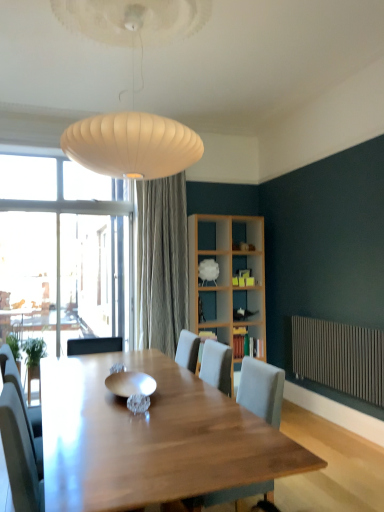
What do you see at coordinates (213, 335) in the screenshot?
I see `wooden bookshelf at center, the second shelf ordered from the bottom` at bounding box center [213, 335].

Where is `wooden bookshelf at center, positioned as the 1th shelf in bottom-to-top order`? Image resolution: width=384 pixels, height=512 pixels. wooden bookshelf at center, positioned as the 1th shelf in bottom-to-top order is located at coordinates 247,344.

Based on the photo, measure the distance between metallic radiator at lower right and camera.

The distance of metallic radiator at lower right from camera is 3.45 meters.

Locate an element on the screen. The width and height of the screenshot is (384, 512). wooden bookshelf at center, the second shelf ordered from the bottom is located at coordinates (213, 335).

Between white fabric at upper center, marked as the 1th shelf in a top-to-bottom arrangement, and wooden bookshelf at center, placed as the 2th shelf when sorted from top to bottom, which one has more height?

Standing taller between the two is white fabric at upper center, marked as the 1th shelf in a top-to-bottom arrangement.

Does white fabric at upper center, marked as the 1th shelf in a top-to-bottom arrangement, have a smaller size compared to wooden bookshelf at center, the second shelf ordered from the bottom?

Incorrect, white fabric at upper center, marked as the 1th shelf in a top-to-bottom arrangement, is not smaller in size than wooden bookshelf at center, the second shelf ordered from the bottom.

Is point (198, 271) closer or farther from the camera than point (222, 330)?

Point (198, 271).

From a real-world perspective, is white fabric at upper center, the third shelf in the bottom-to-top sequence, physically located above or below wooden bookshelf at center, the second shelf ordered from the bottom?

In terms of real-world spatial position, white fabric at upper center, the third shelf in the bottom-to-top sequence, is above wooden bookshelf at center, the second shelf ordered from the bottom.

Considering the positions of objects wooden bookshelf at center, positioned as the 1th shelf in bottom-to-top order, and shiny metallic bowl at center in the image provided, who is in front, wooden bookshelf at center, positioned as the 1th shelf in bottom-to-top order, or shiny metallic bowl at center?

shiny metallic bowl at center is closer to the camera.

Can you confirm if wooden bookshelf at center, positioned as the 1th shelf in bottom-to-top order, is wider than shiny metallic bowl at center?

Yes, wooden bookshelf at center, positioned as the 1th shelf in bottom-to-top order, is wider than shiny metallic bowl at center.

Considering the sizes of wooden bookshelf at center, marked as the 3th shelf in a top-to-bottom arrangement, and shiny metallic bowl at center in the image, is wooden bookshelf at center, marked as the 3th shelf in a top-to-bottom arrangement, taller or shorter than shiny metallic bowl at center?

wooden bookshelf at center, marked as the 3th shelf in a top-to-bottom arrangement, is taller than shiny metallic bowl at center.

Consider the image. Could you tell me if metallic radiator at lower right is facing wooden bookshelf at center, positioned as the 1th shelf in bottom-to-top order?

No, metallic radiator at lower right is not turned towards wooden bookshelf at center, positioned as the 1th shelf in bottom-to-top order.

Consider the image. From the image's perspective, is metallic radiator at lower right located above wooden bookshelf at center, positioned as the 1th shelf in bottom-to-top order?

Yes, from the image's perspective, metallic radiator at lower right is over wooden bookshelf at center, positioned as the 1th shelf in bottom-to-top order.

From the picture: Which object is further away from the camera, metallic radiator at lower right or wooden bookshelf at center, marked as the 3th shelf in a top-to-bottom arrangement?

wooden bookshelf at center, marked as the 3th shelf in a top-to-bottom arrangement.

From a real-world perspective, is wooden bookshelf at center, placed as the 2th shelf when sorted from top to bottom, beneath wooden bookshelf at center, positioned as the 1th shelf in bottom-to-top order?

Actually, wooden bookshelf at center, placed as the 2th shelf when sorted from top to bottom, is physically above wooden bookshelf at center, positioned as the 1th shelf in bottom-to-top order, in the real world.

Is wooden bookshelf at center, the second shelf ordered from the bottom, facing away from wooden bookshelf at center, marked as the 3th shelf in a top-to-bottom arrangement?

No, wooden bookshelf at center, marked as the 3th shelf in a top-to-bottom arrangement, is not at the back of wooden bookshelf at center, the second shelf ordered from the bottom.

Consider the image. Can you confirm if wooden bookshelf at center, placed as the 2th shelf when sorted from top to bottom, is taller than wooden bookshelf at center, positioned as the 1th shelf in bottom-to-top order?

Incorrect, the height of wooden bookshelf at center, placed as the 2th shelf when sorted from top to bottom, is not larger of that of wooden bookshelf at center, positioned as the 1th shelf in bottom-to-top order.

Does wooden bookshelf at center, placed as the 2th shelf when sorted from top to bottom, appear on the left side of wooden bookshelf at center, marked as the 3th shelf in a top-to-bottom arrangement?

Yes.

Does light gray fabric chair at center appear on the left side of wooden bookshelf at center, placed as the 2th shelf when sorted from top to bottom?

Correct, you'll find light gray fabric chair at center to the left of wooden bookshelf at center, placed as the 2th shelf when sorted from top to bottom.

In terms of width, does light gray fabric chair at center look wider or thinner when compared to wooden bookshelf at center, the second shelf ordered from the bottom?

Clearly, light gray fabric chair at center has more width compared to wooden bookshelf at center, the second shelf ordered from the bottom.

Would you say wooden bookshelf at center, the second shelf ordered from the bottom, is part of light gray fabric chair at center's contents?

No, wooden bookshelf at center, the second shelf ordered from the bottom, is not a part of light gray fabric chair at center.

Is metallic radiator at lower right not near light gray fabric chair at center?

Yes.

Does metallic radiator at lower right appear on the right side of light gray fabric chair at center?

Indeed, metallic radiator at lower right is positioned on the right side of light gray fabric chair at center.

How many degrees apart are the facing directions of metallic radiator at lower right and light gray fabric chair at center?

1.74 degrees.

Considering the sizes of objects metallic radiator at lower right and light gray fabric chair at center in the image provided, who is bigger, metallic radiator at lower right or light gray fabric chair at center?

With larger size is light gray fabric chair at center.

From their relative heights in the image, would you say wooden bookshelf at center, marked as the 3th shelf in a top-to-bottom arrangement, is taller or shorter than metallic radiator at lower right?

wooden bookshelf at center, marked as the 3th shelf in a top-to-bottom arrangement, is shorter than metallic radiator at lower right.

How different are the orientations of wooden bookshelf at center, marked as the 3th shelf in a top-to-bottom arrangement, and metallic radiator at lower right in degrees?

The angle between the facing direction of wooden bookshelf at center, marked as the 3th shelf in a top-to-bottom arrangement, and the facing direction of metallic radiator at lower right is 88.9 degrees.

From a real-world perspective, is wooden bookshelf at center, positioned as the 1th shelf in bottom-to-top order, under metallic radiator at lower right?

No.

This screenshot has width=384, height=512. I want to click on shelf that is the 1st one when counting backward from the wooden bookshelf at center, placed as the 2th shelf when sorted from top to bottom, so click(209, 271).

Which shelf is the 3rd one when counting from the right side of the shiny metallic bowl at center? Please provide its 2D coordinates.

[(247, 344)]

When comparing their distances from shiny metallic bowl at center, does wooden bookshelf at center, placed as the 2th shelf when sorted from top to bottom, or white fabric at upper center, the third shelf in the bottom-to-top sequence, seem further?

white fabric at upper center, the third shelf in the bottom-to-top sequence, is positioned further to the anchor shiny metallic bowl at center.

Estimate the real-world distances between objects in this image. Which object is closer to light gray fabric chair at center, wooden bookshelf at center, marked as the 3th shelf in a top-to-bottom arrangement, or wooden bookshelf at center, placed as the 2th shelf when sorted from top to bottom?

wooden bookshelf at center, placed as the 2th shelf when sorted from top to bottom, is positioned closer to the anchor light gray fabric chair at center.

Which object lies further to the anchor point shiny metallic bowl at center, white fabric at upper center, marked as the 1th shelf in a top-to-bottom arrangement, or metallic radiator at lower right?

Among the two, white fabric at upper center, marked as the 1th shelf in a top-to-bottom arrangement, is located further to shiny metallic bowl at center.

Considering their positions, is shiny metallic bowl at center positioned closer to wooden bookshelf at center, the second shelf ordered from the bottom, than light gray fabric chair at center?

shiny metallic bowl at center lies closer to wooden bookshelf at center, the second shelf ordered from the bottom, than the other object.

From the image, which object appears to be farther from wooden bookshelf at center, the second shelf ordered from the bottom, metallic radiator at lower right or white fabric at upper center, marked as the 1th shelf in a top-to-bottom arrangement?

metallic radiator at lower right is positioned further to the anchor wooden bookshelf at center, the second shelf ordered from the bottom.

Looking at the image, which one is located further to wooden bookshelf at center, marked as the 3th shelf in a top-to-bottom arrangement, shiny metallic bowl at center or wooden bookshelf at center, placed as the 2th shelf when sorted from top to bottom?

Among the two, shiny metallic bowl at center is located further to wooden bookshelf at center, marked as the 3th shelf in a top-to-bottom arrangement.

Which object lies nearer to the anchor point shiny metallic bowl at center, light gray fabric chair at center or metallic radiator at lower right?

light gray fabric chair at center is closer to shiny metallic bowl at center.

Estimate the real-world distances between objects in this image. Which object is closer to metallic radiator at lower right, light gray fabric chair at center or wooden bookshelf at center, marked as the 3th shelf in a top-to-bottom arrangement?

wooden bookshelf at center, marked as the 3th shelf in a top-to-bottom arrangement, lies closer to metallic radiator at lower right than the other object.

I want to click on radiator located between shiny metallic bowl at center and wooden bookshelf at center, placed as the 2th shelf when sorted from top to bottom, in the depth direction, so click(340, 357).

Locate an element on the screen. The height and width of the screenshot is (512, 384). radiator positioned between shiny metallic bowl at center and white fabric at upper center, the third shelf in the bottom-to-top sequence, from near to far is located at coordinates (340, 357).

The image size is (384, 512). I want to click on radiator between light gray fabric chair at center and wooden bookshelf at center, placed as the 2th shelf when sorted from top to bottom, along the z-axis, so click(340, 357).

Find the location of a particular element. This screenshot has width=384, height=512. shelf located between shiny metallic bowl at center and white fabric at upper center, marked as the 1th shelf in a top-to-bottom arrangement, in the depth direction is located at coordinates (213, 335).